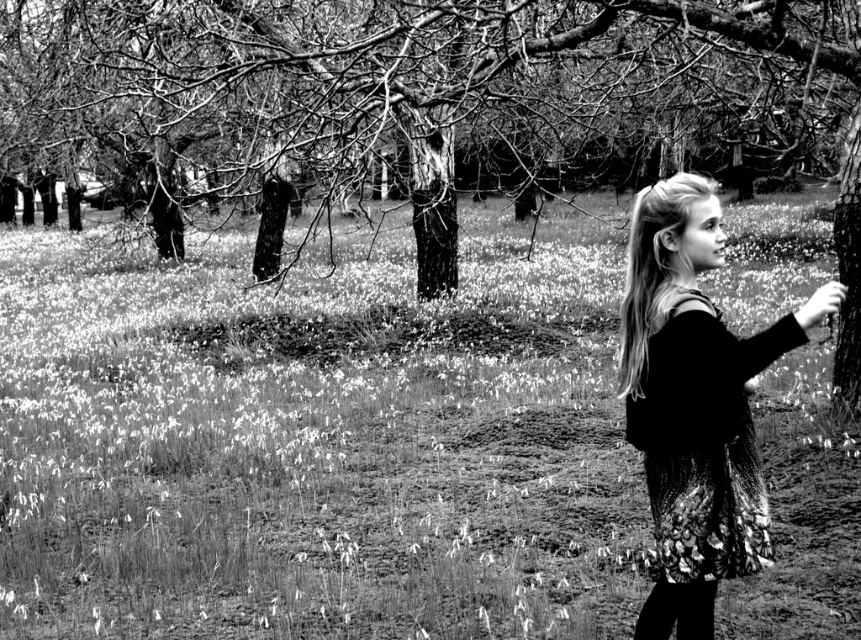
You are a photographer standing in the field of white flowers. You want to capture a photo that includes both the rough bark tree at upper center and the knitted sweater at right. Given that your camera has a focal length of 50mm, which is suitable for capturing objects up to 30 feet apart in the same frame, will you be able to include both in your shot?

The rough bark tree at upper center and the knitted sweater at right are 29.99 feet apart from each other. Since the camera can capture objects up to 30 feet apart, you can include both in the same frame.

You are a photographer analyzing this black and white photo. You notice the white grass at center and the rough bark tree at upper center. Which object is located to the right of the other?

The white grass at center is positioned on the right side of rough bark tree at upper center.

You are a photographer wanting to capture a closeup of the rough bark tree at upper center and the knitted sweater at right in the same frame. Given their sizes, which object should you focus on first to ensure both are in the frame?

The rough bark tree at upper center is larger in size than the knitted sweater at right, so you should focus on the rough bark tree at upper center first to ensure both fit in the frame.